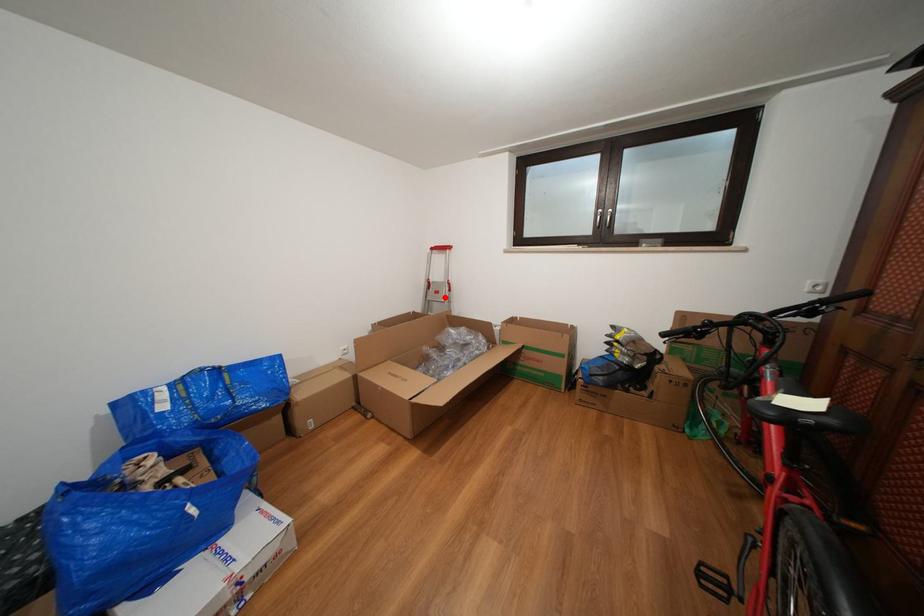
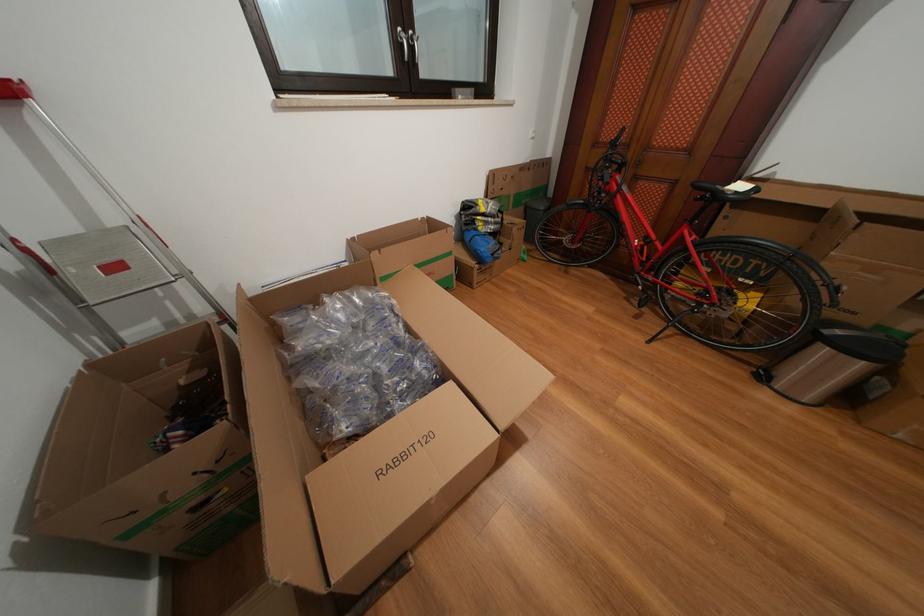
Where in the second image is the point corresponding to the highlighted location from the first image?

(124, 273)